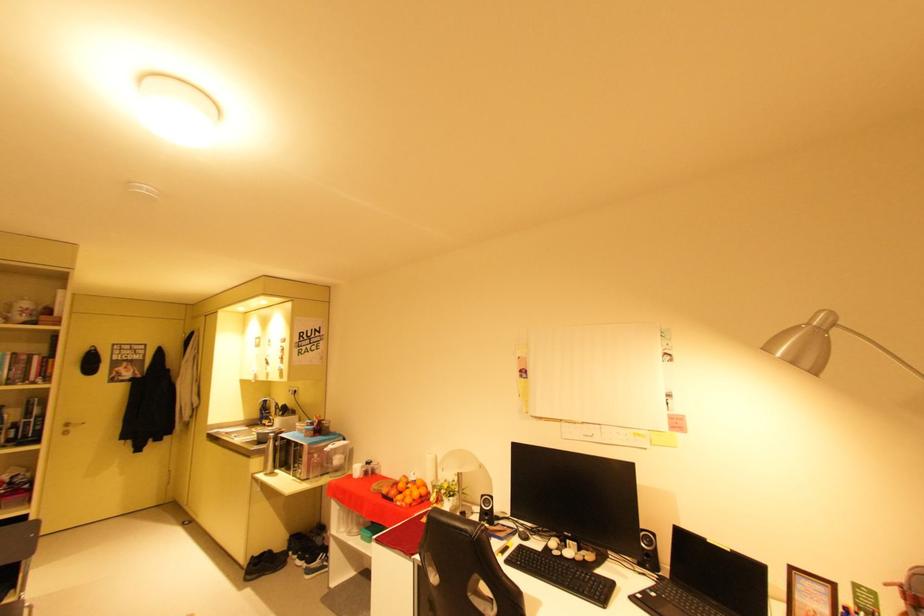
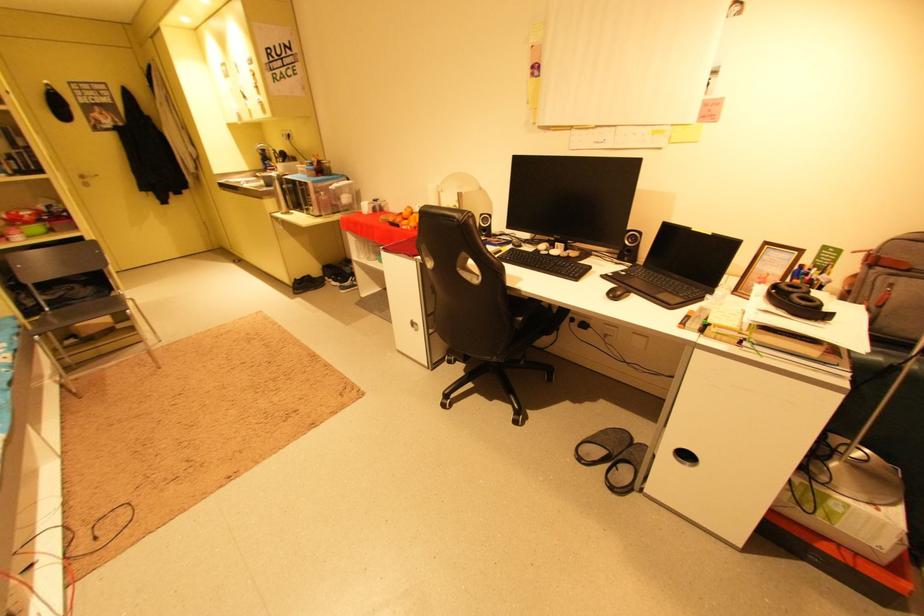
Find the pixel in the second image that matches [338,461] in the first image.

(346, 200)